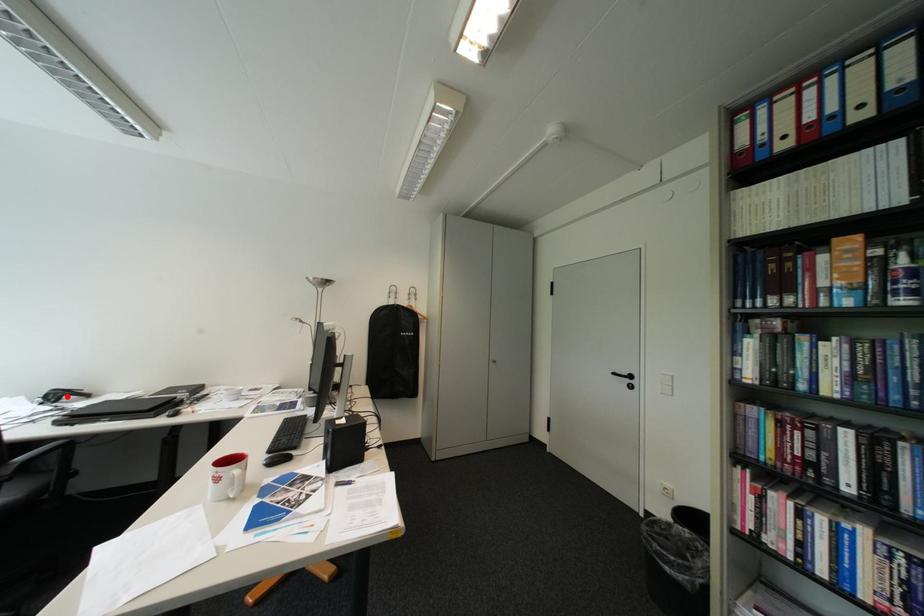
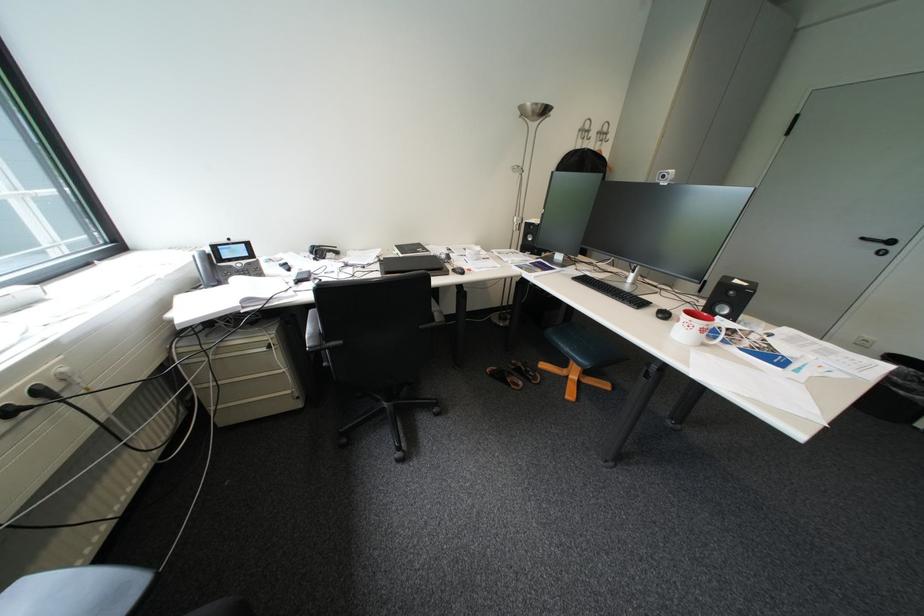
The point at the highlighted location is marked in the first image. Where is the corresponding point in the second image?

(331, 253)